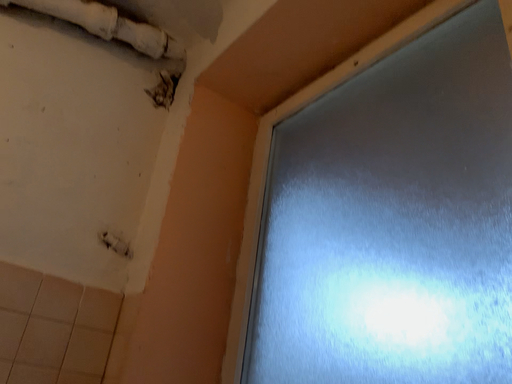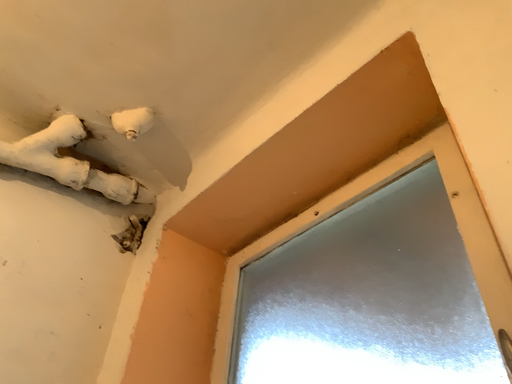
Question: How did the camera likely rotate when shooting the video?

Choices:
 (A) rotated upward
 (B) rotated downward

Answer: (A)